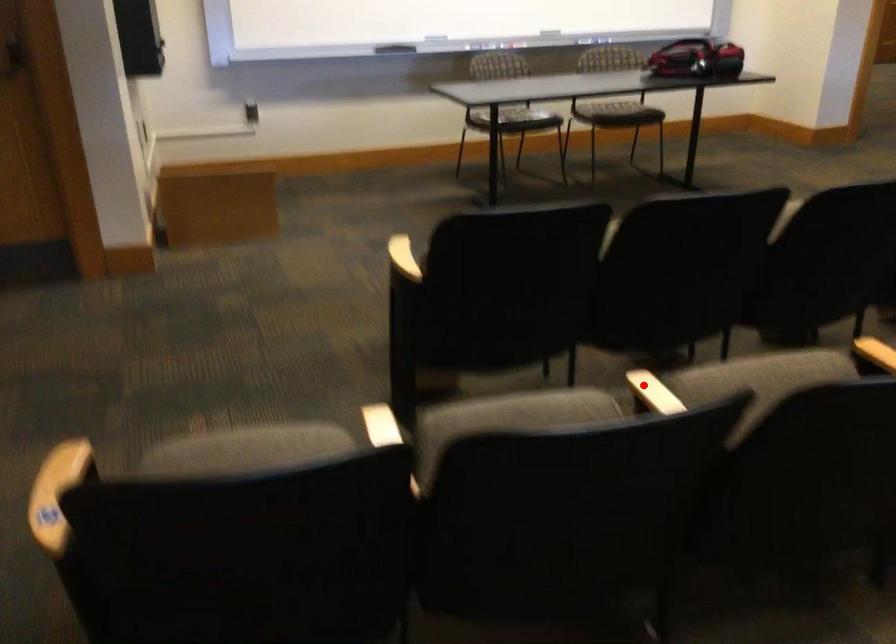
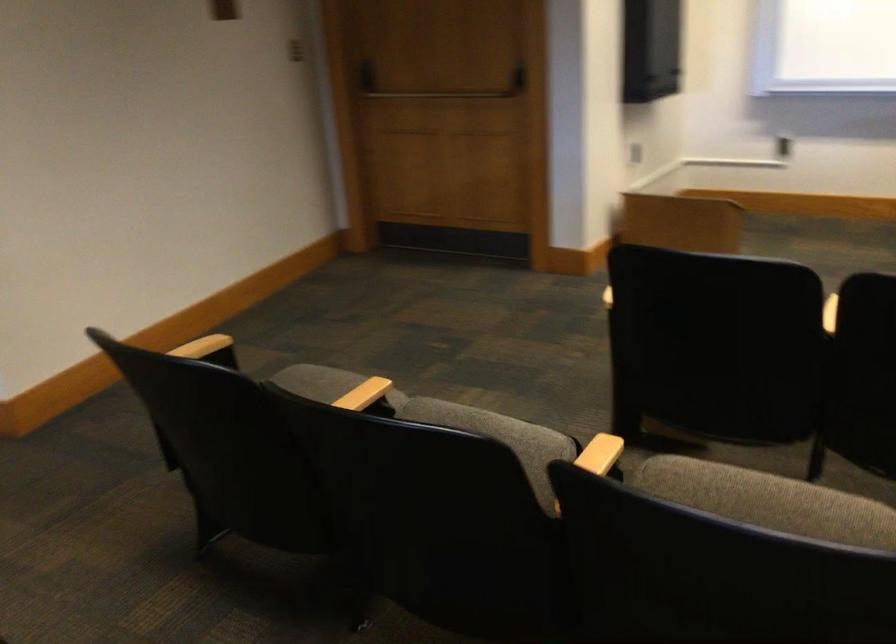
Locate, in the second image, the point that corresponds to the highlighted location in the first image.

(600, 455)